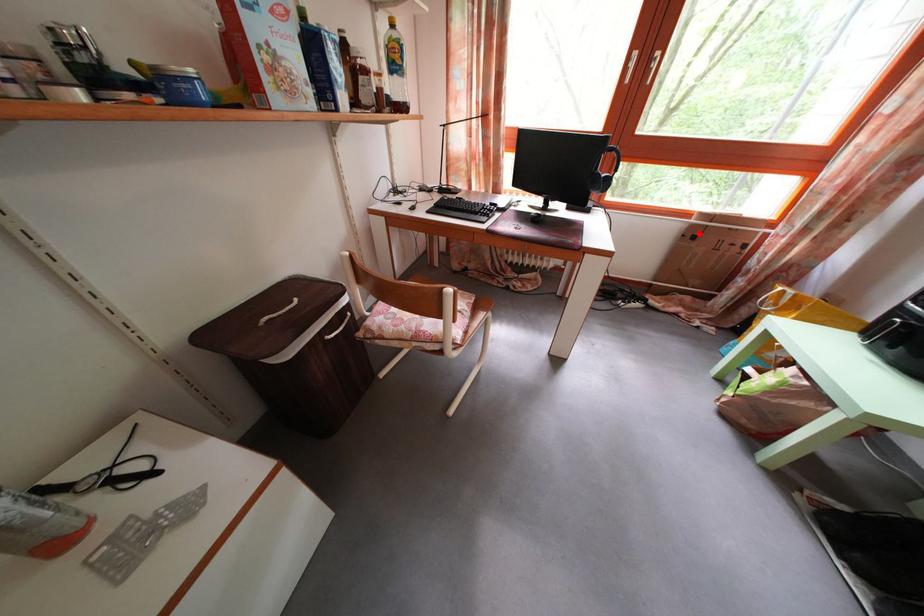
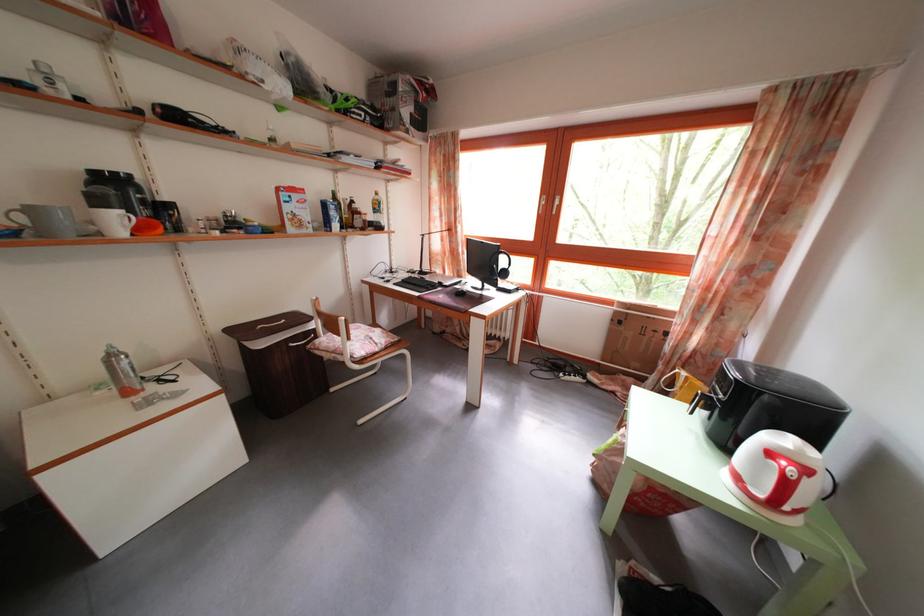
In the second image, find the point that corresponds to the highlighted location in the first image.

(623, 320)